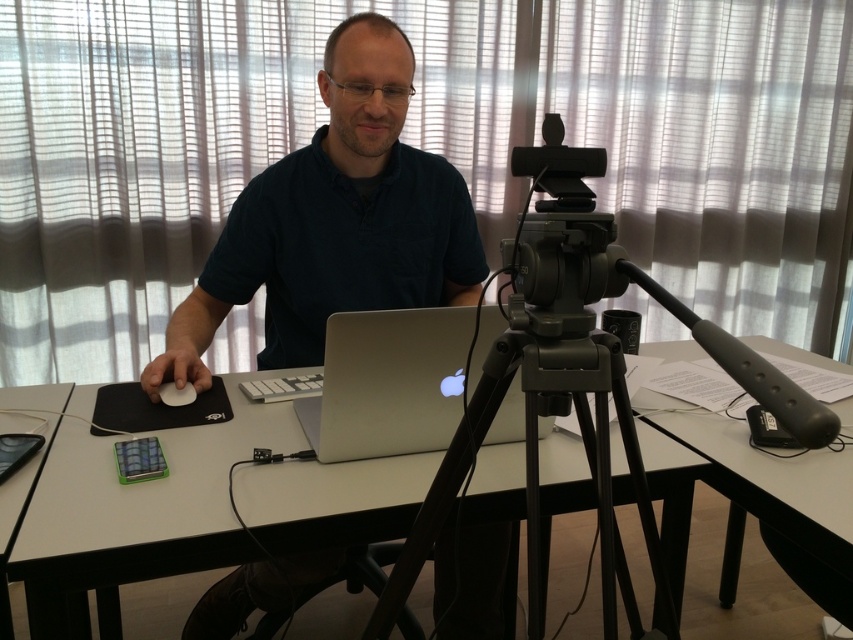
Which is below, white plastic table at right or white matte mouse at center?

white plastic table at right is lower down.

Can you confirm if white plastic table at right is shorter than white matte mouse at center?

No.

Locate an element on the screen. white plastic table at right is located at coordinates (773, 497).

Is point (207, 284) positioned after point (824, 595)?

Yes.

Is matte black shirt at center shorter than white plastic table at right?

In fact, matte black shirt at center may be taller than white plastic table at right.

Where is `matte black shirt at center`? matte black shirt at center is located at coordinates (335, 221).

Who is more distant from viewer, (438, 380) or (161, 396)?

The point (161, 396) is behind.

Locate an element on the screen. silver metallic laptop at center is located at coordinates (387, 384).

The width and height of the screenshot is (853, 640). I want to click on silver metallic laptop at center, so click(387, 384).